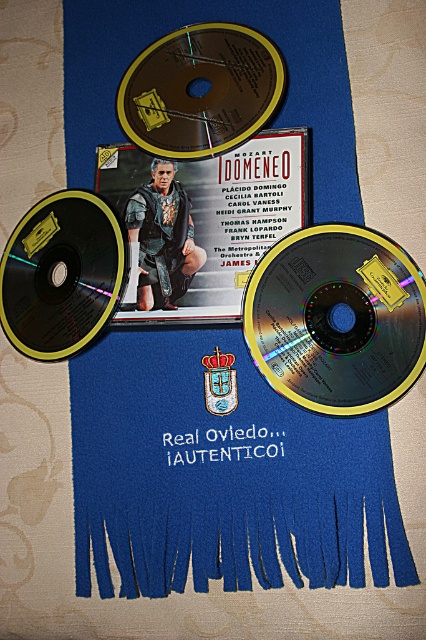
Question: Which is nearer to the black glossy cd at left?

Choices:
 (A) transparent plastic cd at center
 (B) matte black album cover at center

Answer: (B)

Question: Does matte black album cover at center have a greater width compared to gold compact disc at center?

Choices:
 (A) yes
 (B) no

Answer: (A)

Question: Which object is positioned closest to the gold compact disc at center?

Choices:
 (A) matte black album cover at center
 (B) black glossy cd at left

Answer: (A)

Question: Estimate the real-world distances between objects in this image. Which object is closer to the matte black album cover at center?

Choices:
 (A) gold compact disc at center
 (B) black glossy cd at left

Answer: (A)

Question: Is gold compact disc at center thinner than black glossy cd at left?

Choices:
 (A) yes
 (B) no

Answer: (B)

Question: Is transparent plastic cd at center positioned before matte black album cover at center?

Choices:
 (A) no
 (B) yes

Answer: (B)